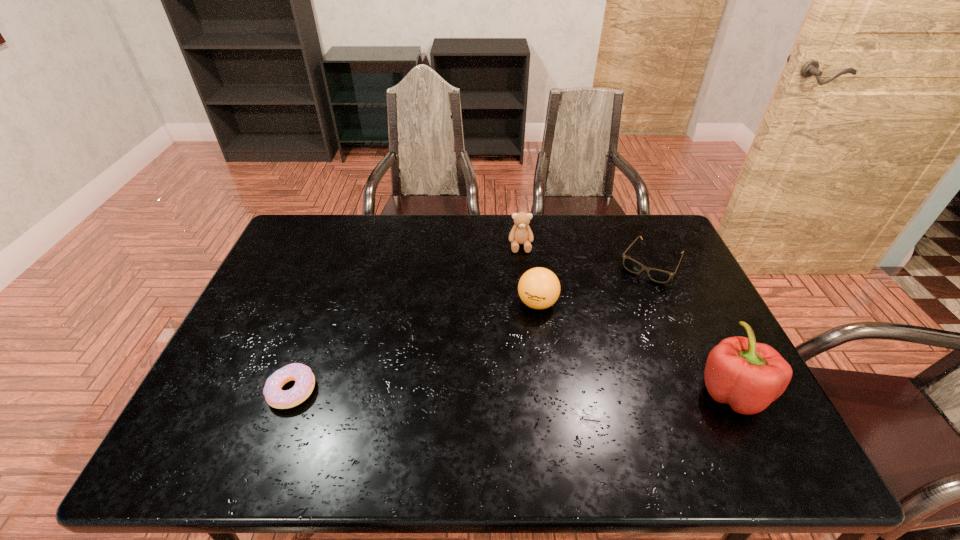
Identify the location of object located at the left edge. The image size is (960, 540). (304, 379).

Find the location of a particular element. The image size is (960, 540). bell pepper that is at the right edge is located at coordinates (749, 376).

Where is `sunglasses that is at the right edge`? Image resolution: width=960 pixels, height=540 pixels. sunglasses that is at the right edge is located at coordinates (661, 276).

The image size is (960, 540). Find the location of `object at the near left corner`. object at the near left corner is located at coordinates (304, 379).

At what (x,y) coordinates should I click in order to perform the action: click on object present at the far right corner. Please return your answer as a coordinate pair (x, y). Image resolution: width=960 pixels, height=540 pixels. Looking at the image, I should click on (x=661, y=276).

Locate an element on the screen. This screenshot has width=960, height=540. object present at the near right corner is located at coordinates (749, 376).

You are a GUI agent. You are given a task and a screenshot of the screen. Output one action in this format:
    pyautogui.click(x=<x>, y=<y>)
    Task: Click on the vacant region at the far edge of the desktop
    
    Given the screenshot: What is the action you would take?
    pyautogui.click(x=389, y=245)

The width and height of the screenshot is (960, 540). I want to click on vacant space at the left edge of the desktop, so pos(267,308).

Image resolution: width=960 pixels, height=540 pixels. Identify the location of free point at the right edge. (676, 309).

I want to click on free space at the far left corner, so click(337, 214).